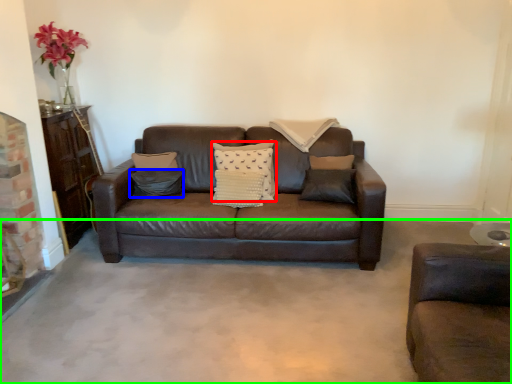
Question: Which is farther away from pillow (highlighted by a red box)? pillow (highlighted by a blue box) or concrete (highlighted by a green box)?

Choices:
 (A) pillow
 (B) concrete

Answer: (B)